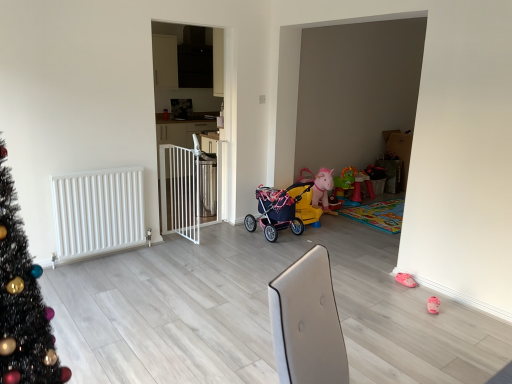
Question: Does matte pink stroller at center have a lesser width compared to white matte radiator at left?

Choices:
 (A) yes
 (B) no

Answer: (B)

Question: Are matte pink stroller at center and white matte radiator at left located far from each other?

Choices:
 (A) no
 (B) yes

Answer: (B)

Question: Is the depth of matte pink stroller at center greater than that of white matte radiator at left?

Choices:
 (A) no
 (B) yes

Answer: (B)

Question: Is matte pink stroller at center facing towards white matte radiator at left?

Choices:
 (A) yes
 (B) no

Answer: (B)

Question: Is matte pink stroller at center shorter than white matte radiator at left?

Choices:
 (A) no
 (B) yes

Answer: (B)

Question: From the image's perspective, is matte pink stroller at center beneath white matte radiator at left?

Choices:
 (A) yes
 (B) no

Answer: (B)

Question: Can you confirm if pink fabric baby carriage at center is positioned to the left of matte pink stroller at center?

Choices:
 (A) yes
 (B) no

Answer: (B)

Question: From a real-world perspective, is pink fabric baby carriage at center on matte pink stroller at center?

Choices:
 (A) no
 (B) yes

Answer: (A)

Question: From a real-world perspective, is pink fabric baby carriage at center beneath matte pink stroller at center?

Choices:
 (A) no
 (B) yes

Answer: (B)

Question: Considering the relative sizes of pink fabric baby carriage at center and matte pink stroller at center in the image provided, is pink fabric baby carriage at center shorter than matte pink stroller at center?

Choices:
 (A) yes
 (B) no

Answer: (A)

Question: Can you confirm if pink fabric baby carriage at center is bigger than matte pink stroller at center?

Choices:
 (A) no
 (B) yes

Answer: (A)

Question: Is pink fabric baby carriage at center turned away from matte pink stroller at center?

Choices:
 (A) yes
 (B) no

Answer: (B)

Question: Is white matte radiator at left not within white metal gate at center?

Choices:
 (A) no
 (B) yes

Answer: (B)